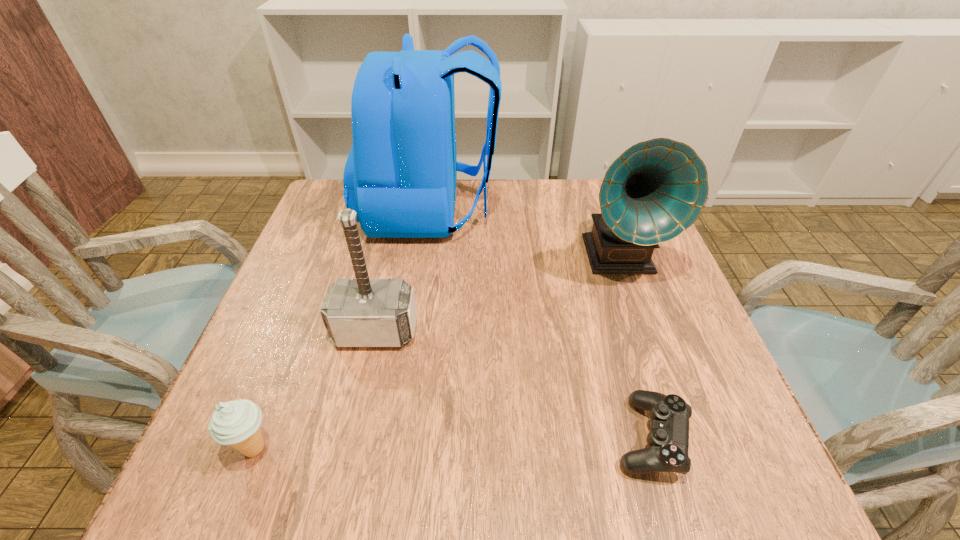
Identify the location of the tallest object. This screenshot has height=540, width=960. (400, 176).

Identify the location of phonograph_record. (655, 190).

The width and height of the screenshot is (960, 540). Identify the location of hammer. (362, 312).

At what (x,y) coordinates should I click in order to perform the action: click on the fourth tallest object. Please return your answer as a coordinate pair (x, y). Looking at the image, I should click on (236, 423).

Find the location of `icecream`. icecream is located at coordinates (236, 423).

Locate an element on the screen. Image resolution: width=960 pixels, height=540 pixels. the shortest object is located at coordinates (668, 440).

You are a GUI agent. You are given a task and a screenshot of the screen. Output one action in this format:
    pyautogui.click(x=<x>, y=<y>)
    Task: Click on the free spot located on the back of the backpack
    
    Given the screenshot: What is the action you would take?
    pyautogui.click(x=634, y=210)

This screenshot has width=960, height=540. In order to click on blank space located from the horn of the phonograph_record in this screenshot , I will do `click(682, 435)`.

This screenshot has width=960, height=540. I want to click on vacant space located 0.130m for striking with the head of the hammer, so click(x=357, y=413).

Where is `free region located on the right of the fourth tallest object`? free region located on the right of the fourth tallest object is located at coordinates (321, 448).